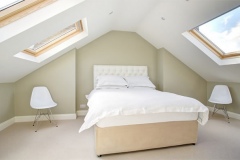
Image resolution: width=240 pixels, height=160 pixels. I want to click on light fixture, so click(x=162, y=30), click(x=117, y=19), click(x=186, y=9), click(x=122, y=7).